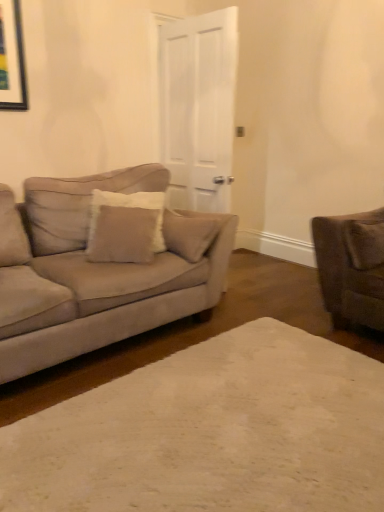
Question: Is beige carpet at center at the right side of suede-like brown pillow at right, positioned as the 1th pillow in right-to-left order?

Choices:
 (A) no
 (B) yes

Answer: (A)

Question: Is beige carpet at center shorter than suede-like brown pillow at right, positioned as the 1th pillow in right-to-left order?

Choices:
 (A) no
 (B) yes

Answer: (B)

Question: From the image's perspective, is beige carpet at center located beneath suede-like brown pillow at right, acting as the second pillow starting from the left?

Choices:
 (A) no
 (B) yes

Answer: (B)

Question: Is beige carpet at center touching suede-like brown pillow at right, positioned as the 1th pillow in right-to-left order?

Choices:
 (A) yes
 (B) no

Answer: (B)

Question: Does beige carpet at center have a greater width compared to suede-like brown pillow at right, acting as the second pillow starting from the left?

Choices:
 (A) yes
 (B) no

Answer: (A)

Question: Does point (352, 226) appear closer or farther from the camera than point (38, 230)?

Choices:
 (A) farther
 (B) closer

Answer: (A)

Question: Is suede-like brown pillow at right, acting as the second pillow starting from the left, inside or outside of suede beige couch at left?

Choices:
 (A) outside
 (B) inside

Answer: (A)

Question: Considering the positions of suede-like brown pillow at right, positioned as the 1th pillow in right-to-left order, and suede beige couch at left in the image, is suede-like brown pillow at right, positioned as the 1th pillow in right-to-left order, wider or thinner than suede beige couch at left?

Choices:
 (A) thin
 (B) wide

Answer: (A)

Question: From the image's perspective, relative to suede beige couch at left, is suede-like brown pillow at right, acting as the second pillow starting from the left, above or below?

Choices:
 (A) below
 (B) above

Answer: (B)

Question: Relative to suede-like brown pillow at right, acting as the second pillow starting from the left, is beige carpet at center in front or behind?

Choices:
 (A) front
 (B) behind

Answer: (A)

Question: Considering the positions of beige carpet at center and suede-like brown pillow at right, acting as the second pillow starting from the left, in the image, is beige carpet at center bigger or smaller than suede-like brown pillow at right, acting as the second pillow starting from the left,?

Choices:
 (A) small
 (B) big

Answer: (B)

Question: In terms of width, does beige carpet at center look wider or thinner when compared to suede-like brown pillow at right, positioned as the 1th pillow in right-to-left order?

Choices:
 (A) thin
 (B) wide

Answer: (B)

Question: From the image's perspective, relative to suede-like brown pillow at right, acting as the second pillow starting from the left, is beige carpet at center above or below?

Choices:
 (A) below
 (B) above

Answer: (A)

Question: Relative to suede-like brown pillow at right, acting as the second pillow starting from the left, is white matte door at center in front or behind?

Choices:
 (A) behind
 (B) front

Answer: (A)

Question: Looking at the image, does white matte door at center seem bigger or smaller compared to suede-like brown pillow at right, positioned as the 1th pillow in right-to-left order?

Choices:
 (A) big
 (B) small

Answer: (A)